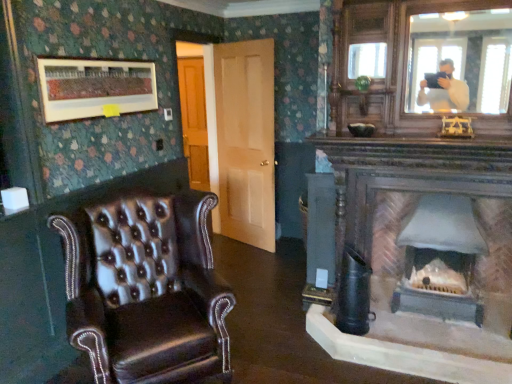
Question: Does leather wingback chair at left come in front of light brown wood door at center?

Choices:
 (A) no
 (B) yes

Answer: (B)

Question: Is leather wingback chair at left at the right side of light brown wood door at center?

Choices:
 (A) yes
 (B) no

Answer: (B)

Question: From the image's perspective, is leather wingback chair at left above light brown wood door at center?

Choices:
 (A) yes
 (B) no

Answer: (B)

Question: Is leather wingback chair at left facing towards light brown wood door at center?

Choices:
 (A) yes
 (B) no

Answer: (B)

Question: Are leather wingback chair at left and light brown wood door at center far apart?

Choices:
 (A) yes
 (B) no

Answer: (A)

Question: Is leather wingback chair at left bigger or smaller than matte wooden picture frame at upper left?

Choices:
 (A) big
 (B) small

Answer: (A)

Question: Considering the positions of leather wingback chair at left and matte wooden picture frame at upper left in the image, is leather wingback chair at left wider or thinner than matte wooden picture frame at upper left?

Choices:
 (A) thin
 (B) wide

Answer: (B)

Question: From the image's perspective, is leather wingback chair at left above or below matte wooden picture frame at upper left?

Choices:
 (A) above
 (B) below

Answer: (B)

Question: Would you say leather wingback chair at left is inside or outside matte wooden picture frame at upper left?

Choices:
 (A) outside
 (B) inside

Answer: (A)

Question: From their relative heights in the image, would you say matte gray stone fireplace at center is taller or shorter than light brown wood door at center?

Choices:
 (A) short
 (B) tall

Answer: (A)

Question: From a real-world perspective, is matte gray stone fireplace at center above or below light brown wood door at center?

Choices:
 (A) above
 (B) below

Answer: (B)

Question: Visually, is matte gray stone fireplace at center positioned to the left or to the right of light brown wood door at center?

Choices:
 (A) right
 (B) left

Answer: (A)

Question: Looking at the image, does matte gray stone fireplace at center seem bigger or smaller compared to light brown wood door at center?

Choices:
 (A) big
 (B) small

Answer: (B)

Question: From a real-world perspective, is matte gray stone fireplace at center above or below matte wooden picture frame at upper left?

Choices:
 (A) below
 (B) above

Answer: (A)

Question: Considering the positions of matte gray stone fireplace at center and matte wooden picture frame at upper left in the image, is matte gray stone fireplace at center bigger or smaller than matte wooden picture frame at upper left?

Choices:
 (A) big
 (B) small

Answer: (A)